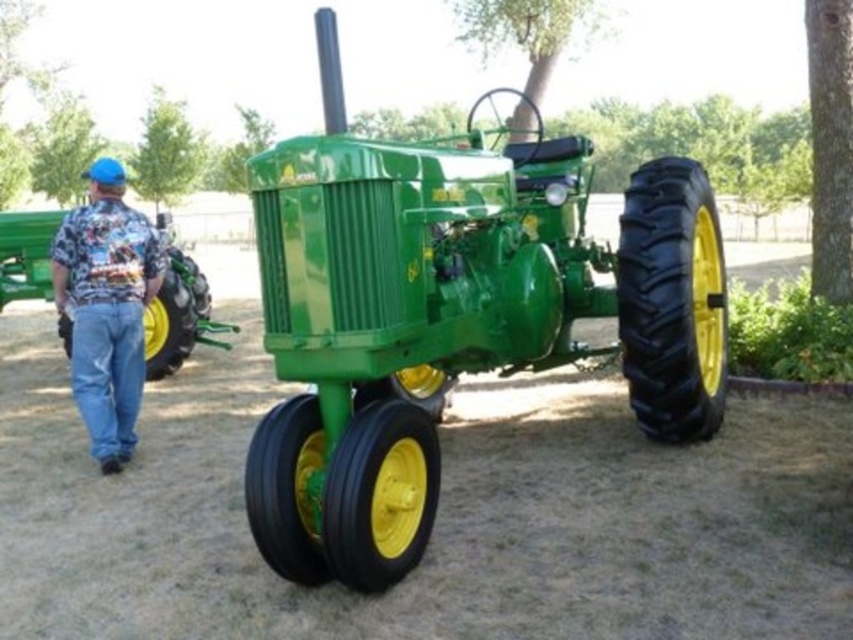
Question: Can you confirm if green polished metal tractor at center is wider than green matte tractor at left?

Choices:
 (A) no
 (B) yes

Answer: (B)

Question: Which object appears closest to the camera in this image?

Choices:
 (A) green polished metal tractor at center
 (B) green matte tractor at left

Answer: (A)

Question: Which object is positioned farthest from the floral shirt at left?

Choices:
 (A) green matte tractor at left
 (B) green polished metal tractor at center

Answer: (B)

Question: Is green polished metal tractor at center thinner than green matte tractor at left?

Choices:
 (A) no
 (B) yes

Answer: (A)

Question: Which of these objects is positioned closest to the green polished metal tractor at center?

Choices:
 (A) floral shirt at left
 (B) green matte tractor at left

Answer: (A)

Question: Is floral shirt at left further to camera compared to green matte tractor at left?

Choices:
 (A) no
 (B) yes

Answer: (A)